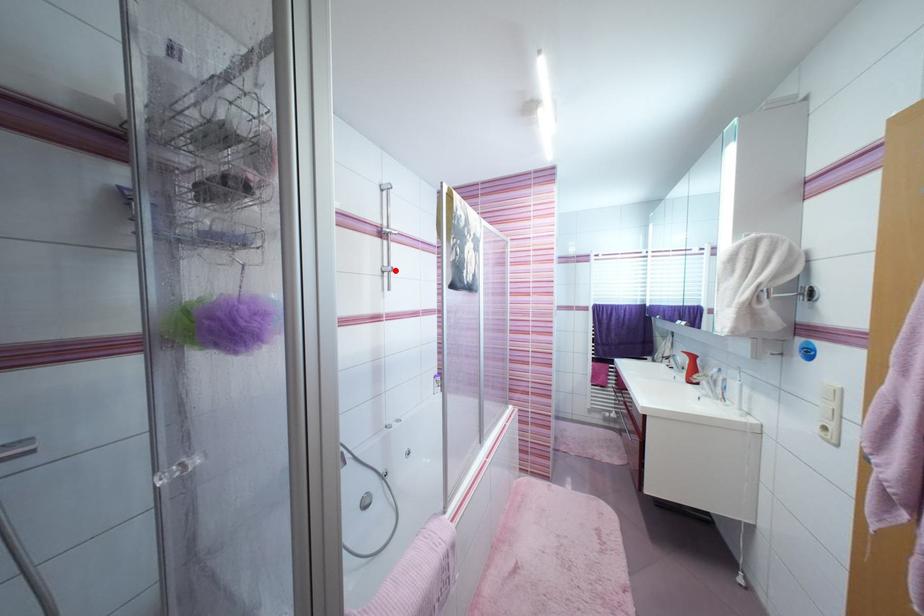
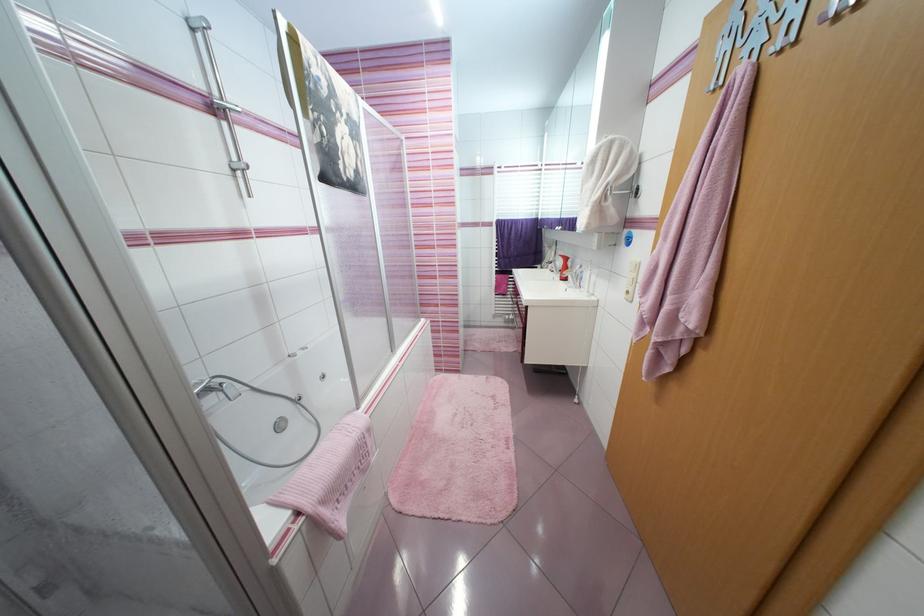
The point at the highlighted location is marked in the first image. Where is the corresponding point in the second image?

(249, 167)